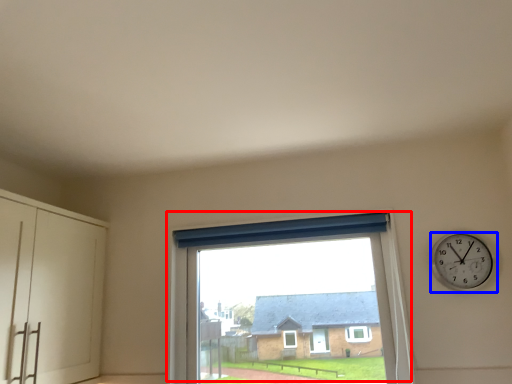
Question: Which point is closer to the camera, window (highlighted by a red box) or wall clock (highlighted by a blue box)?

Choices:
 (A) window
 (B) wall clock

Answer: (B)